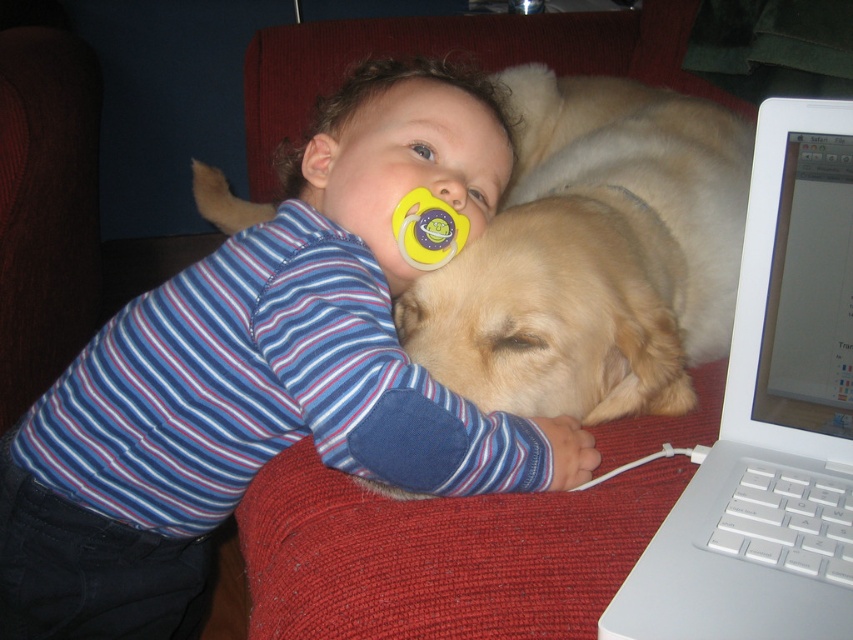
Question: Which object is the closest to the blue striped shirt at upper left?

Choices:
 (A) golden fur dog at center
 (B) yellow rubber pacifier at upper center

Answer: (A)

Question: Which object is the closest to the white plastic laptop at right?

Choices:
 (A) yellow rubber pacifier at upper center
 (B) blue striped shirt at upper left
 (C) golden fur dog at center

Answer: (C)

Question: Is blue striped shirt at upper left smaller than golden fur dog at center?

Choices:
 (A) yes
 (B) no

Answer: (B)

Question: Does golden fur dog at center have a lesser width compared to yellow rubber pacifier at upper center?

Choices:
 (A) no
 (B) yes

Answer: (A)

Question: Can you confirm if blue striped shirt at upper left is wider than golden fur dog at center?

Choices:
 (A) yes
 (B) no

Answer: (A)

Question: Which point is farther to the camera?

Choices:
 (A) (715, 499)
 (B) (521, 266)
 (C) (401, 241)
 (D) (363, 129)

Answer: (D)